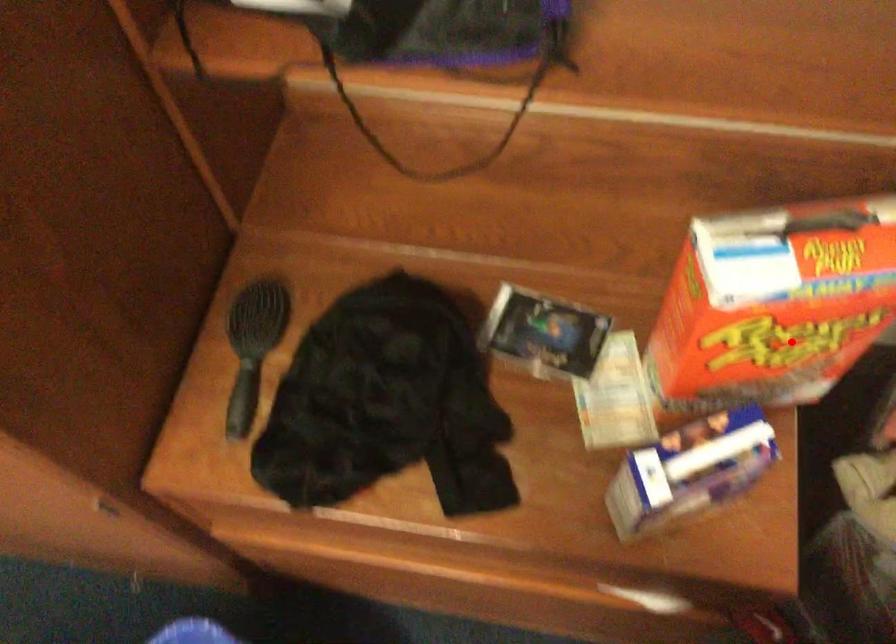
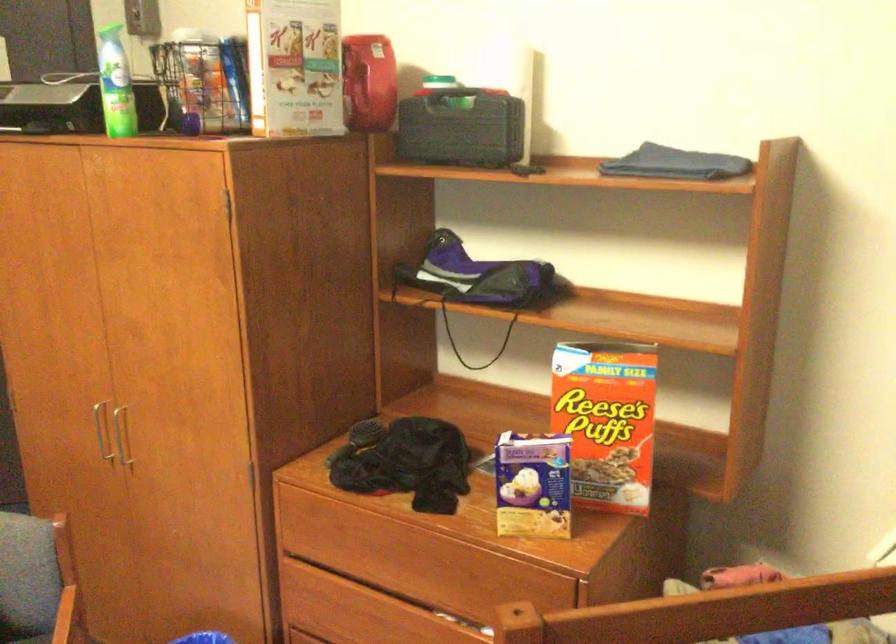
Question: I am providing you with two images of the same scene from different viewpoints. Image1 has a red point marked. In image2, the corresponding 3D location appears at what relative position? Reply with the corresponding letter.

Choices:
 (A) Closer
 (B) Farther

Answer: (B)